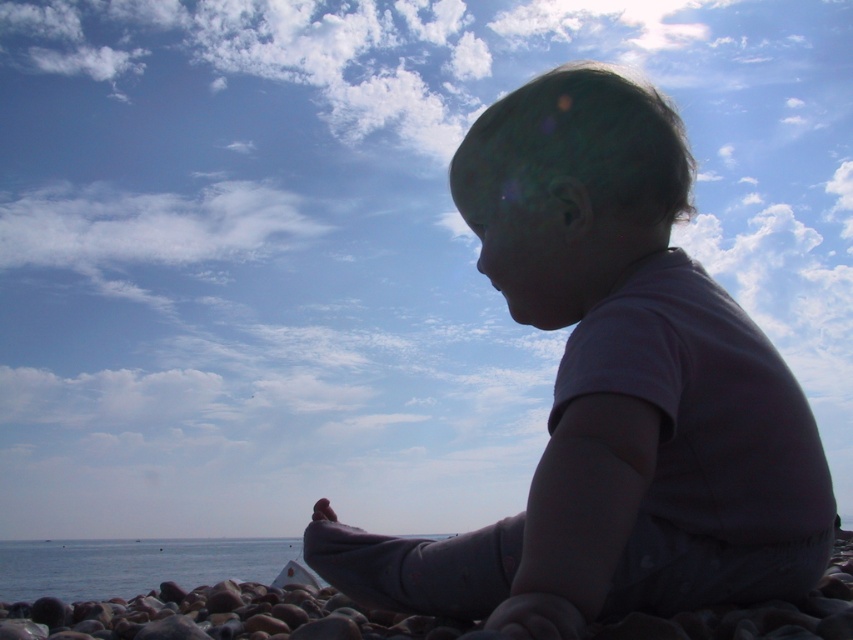
Between purple cotton baby at center and blue water at lower left, which one has less height?

blue water at lower left is shorter.

Describe the element at coordinates (611, 392) in the screenshot. This screenshot has width=853, height=640. I see `purple cotton baby at center` at that location.

I want to click on purple cotton baby at center, so click(611, 392).